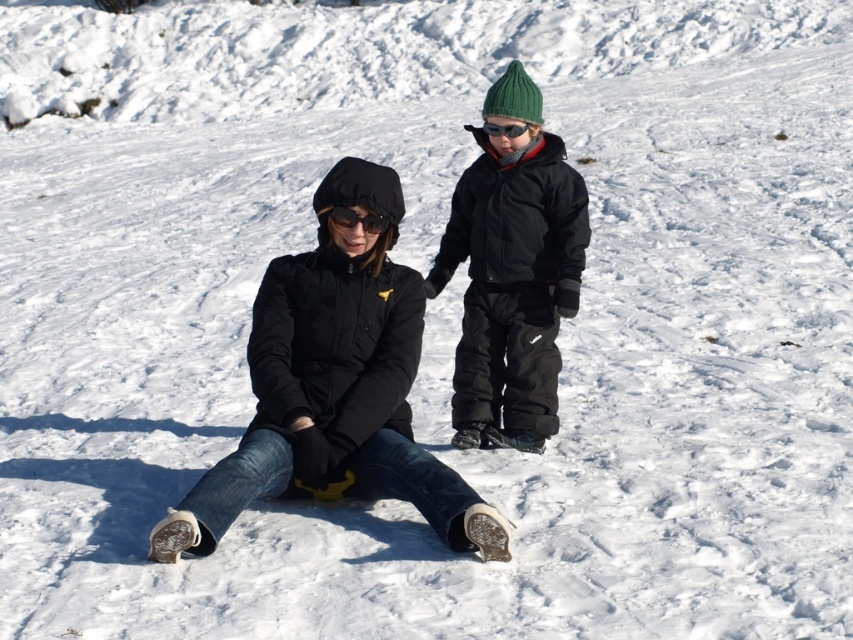
Question: Does matte black snowsuit at right appear over matte black goggles at center?

Choices:
 (A) yes
 (B) no

Answer: (B)

Question: Can you confirm if black matte jacket at center is positioned to the right of matte black goggles at center?

Choices:
 (A) no
 (B) yes

Answer: (B)

Question: Which object is positioned farthest from the black matte jacket at center?

Choices:
 (A) black matte goggles at upper center
 (B) matte black goggles at center

Answer: (A)

Question: Among these points, which one is farthest from the camera?

Choices:
 (A) (527, 189)
 (B) (527, 124)

Answer: (A)

Question: Among these points, which one is nearest to the camera?

Choices:
 (A) [511, 131]
 (B) [476, 138]
 (C) [340, 220]
 (D) [498, 438]

Answer: (C)

Question: Can you confirm if matte black snowsuit at right is smaller than matte black goggles at center?

Choices:
 (A) no
 (B) yes

Answer: (A)